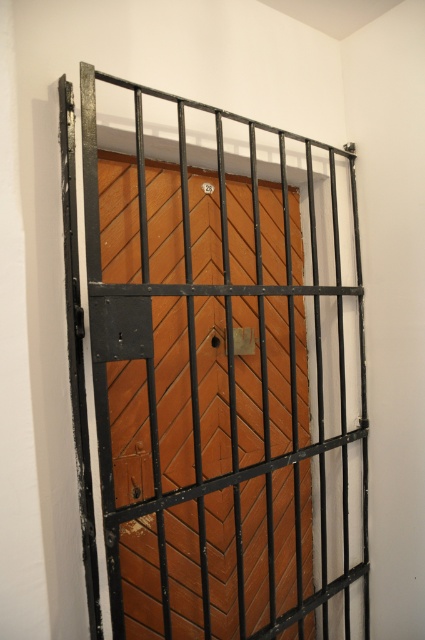
In the scene shown: You are trying to enter the room through the gate. You see a brown wooden door at center and a metallic gold lock at center. Which object is closer to the ground?

The brown wooden door at center is positioned under the metallic gold lock at center, so the brown wooden door at center is closer to the ground.

You need to place a new label on the brown wooden door at center so it doesn not cover the metallic gold lock at center. Given that the lock is smaller, where should you position the new label?

The brown wooden door at center is larger in size than metallic gold lock at center, so you can position the new label on the door away from the lock to avoid covering it.

You are a painter who needs to hang a picture frame that is 1.2 meters tall. You have two options to hang it on either the brown wooden door at center or the metallic gold lock at center. Which surface can accommodate the frame based on their sizes?

The brown wooden door at center is much taller than the metallic gold lock at center, so the picture frame can be hung on the brown wooden door at center as it has sufficient height.